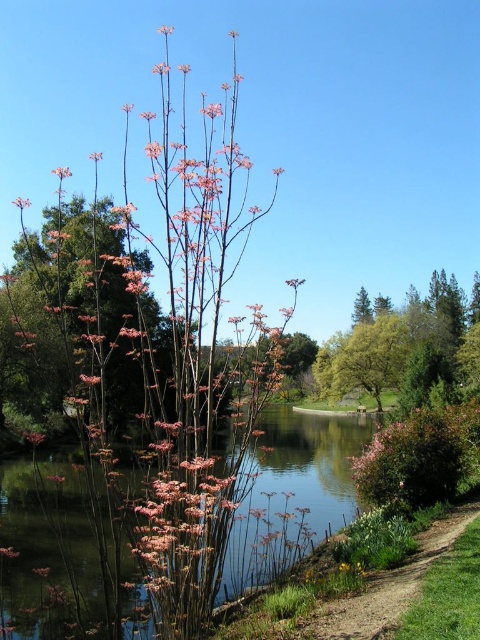
From the picture: You are an observer looking at the scene. You notice the clear water at center and the pink matte flower at upper center. Which object is positioned higher in the image?

The pink matte flower at upper center is positioned higher in the image than the clear water at center.

You are an artist trying to paint this scene. You want to ensure the clear water at center and the pink matte flower at upper center are positioned correctly according to their depth. Which object should you paint first to maintain the correct spatial relationship?

You should paint the pink matte flower at upper center first because it is further away than the clear water at center, allowing you to layer the closer object on top later.

You are an artist planning to paint the scene. You want to ensure the clear water at center and pink matte flower at upper center are proportionally accurate. Which object should you paint first to maintain scale, considering their sizes?

You should paint the pink matte flower at upper center first because it is larger than the clear water at center, allowing you to establish the scale before adjusting for smaller details.